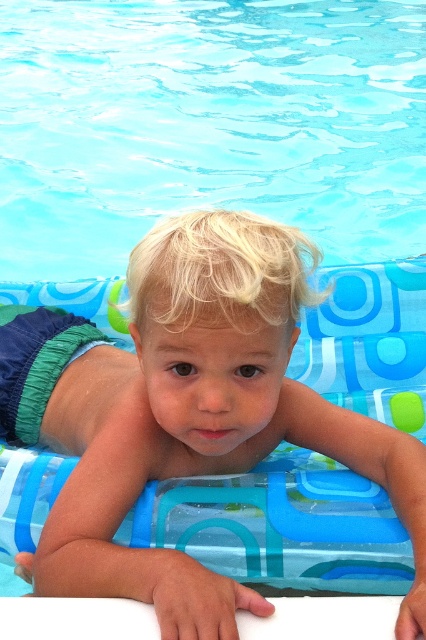
Question: Observing the image, what is the correct spatial positioning of transparent plastic pool at upper center in reference to blonde hair toddler at center?

Choices:
 (A) below
 (B) above

Answer: (B)

Question: Can you confirm if transparent plastic pool at upper center is positioned below blonde hair toddler at center?

Choices:
 (A) yes
 (B) no

Answer: (B)

Question: Which point is farther to the camera?

Choices:
 (A) (267, 81)
 (B) (149, 300)

Answer: (A)

Question: Does transparent plastic pool at upper center appear over blonde hair toddler at center?

Choices:
 (A) no
 (B) yes

Answer: (B)

Question: Which point is closer to the camera taking this photo?

Choices:
 (A) (152, 115)
 (B) (207, 259)

Answer: (B)